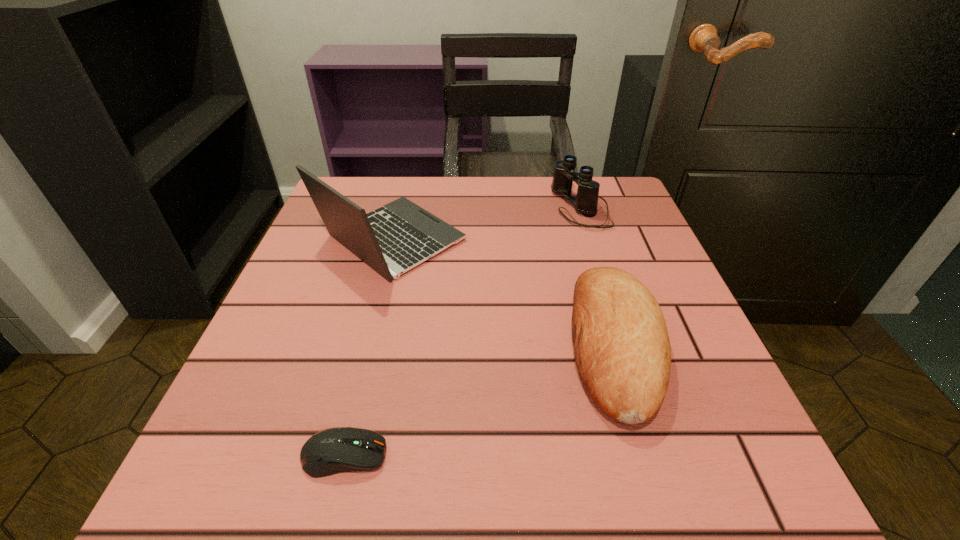
In order to click on vacant region at the left edge of the desktop in this screenshot , I will do `click(292, 412)`.

Identify the location of vacant space at the right edge. (692, 355).

The height and width of the screenshot is (540, 960). Identify the location of free space at the near right corner. (694, 461).

Where is `unoccupied area between the shortest object and the third tallest object`? This screenshot has width=960, height=540. unoccupied area between the shortest object and the third tallest object is located at coordinates (480, 400).

Identify the location of unoccupied area between the binoculars and the computer equipment. (462, 331).

This screenshot has width=960, height=540. I want to click on free area in between the tallest object and the bread, so click(504, 293).

Locate an element on the screen. This screenshot has width=960, height=540. unoccupied area between the computer equipment and the laptop_computer is located at coordinates (368, 348).

Where is `vacant area that lies between the shortest object and the binoculars`? This screenshot has height=540, width=960. vacant area that lies between the shortest object and the binoculars is located at coordinates (462, 331).

The width and height of the screenshot is (960, 540). Find the location of `free space between the third tallest object and the computer equipment`. free space between the third tallest object and the computer equipment is located at coordinates (480, 400).

Find the location of `empty space that is in between the shortest object and the binoculars`. empty space that is in between the shortest object and the binoculars is located at coordinates (462, 331).